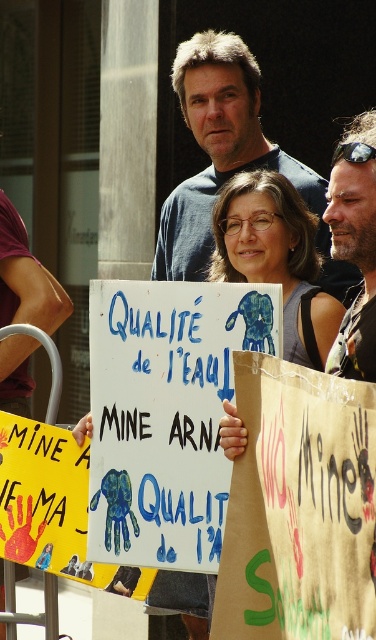
Does white paper sign at center have a greater width compared to matte blue sign at center?

Yes, white paper sign at center is wider than matte blue sign at center.

Does white paper sign at center come in front of matte blue sign at center?

Yes, it is.

Is point (322, 369) farther from camera compared to point (230, 262)?

No, (322, 369) is in front of (230, 262).

Image resolution: width=376 pixels, height=640 pixels. Find the location of `white paper sign at center`. white paper sign at center is located at coordinates (277, 259).

Can you confirm if blue cotton shirt at center is taller than white paper sign at center?

Correct, blue cotton shirt at center is much taller as white paper sign at center.

From the picture: Is blue cotton shirt at center closer to camera compared to white paper sign at center?

No, it is not.

Between point (236, 60) and point (288, 285), which one is positioned in front?

Point (288, 285) is more forward.

At what (x,y) coordinates should I click in order to perform the action: click on blue cotton shirt at center. Please return your answer as a coordinate pair (x, y). The image size is (376, 640). Looking at the image, I should click on (228, 157).

In the scene shown: Who is more forward, (x=294, y=157) or (x=285, y=272)?

Point (x=285, y=272)

Is blue cotton shirt at center wider than matte blue sign at center?

Indeed, blue cotton shirt at center has a greater width compared to matte blue sign at center.

This screenshot has width=376, height=640. What do you see at coordinates (228, 157) in the screenshot?
I see `blue cotton shirt at center` at bounding box center [228, 157].

The height and width of the screenshot is (640, 376). In order to click on blue cotton shirt at center in this screenshot , I will do `click(228, 157)`.